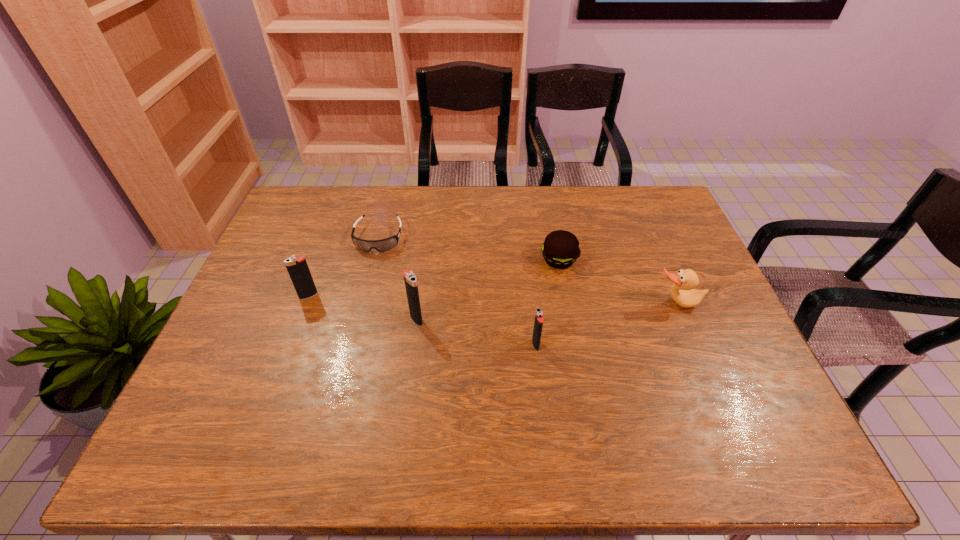
Where is `unoccupied area between the fifth tallest object and the second farthest igniter`? This screenshot has width=960, height=540. unoccupied area between the fifth tallest object and the second farthest igniter is located at coordinates (488, 289).

This screenshot has width=960, height=540. What are the coordinates of `free space between the patty and the fifth object from right to left` in the screenshot? It's located at (468, 249).

What are the coordinates of `vacant space in between the goggles and the second nearest igniter` in the screenshot? It's located at (397, 279).

Identify the location of empty space that is in between the shortest object and the shortest igniter. (457, 291).

Find the location of `free area in between the nearest igniter and the duck`. free area in between the nearest igniter and the duck is located at coordinates (606, 324).

Locate an element on the screen. empty space that is in between the goggles and the duck is located at coordinates (528, 271).

This screenshot has height=540, width=960. Identify the location of free area in between the fifth object from left to right and the shortest igniter. (547, 302).

What are the coordinates of `the fifth closest object relative to the rightmost object` in the screenshot? It's located at (298, 269).

At what (x,y) coordinates should I click in order to perform the action: click on object that is the third closest to the duck. Please return your answer as a coordinate pair (x, y). Image resolution: width=960 pixels, height=540 pixels. Looking at the image, I should click on (410, 279).

Locate which igniter ranks third in proximity to the fifth object from right to left. Please provide its 2D coordinates. Your answer should be formatted as a tuple, i.e. [(x, y)], where the tuple contains the x and y coordinates of a point satisfying the conditions above.

[(538, 323)]